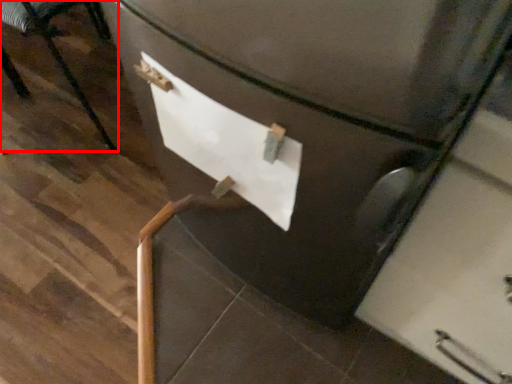
Question: From the image, what is the correct spatial relationship of furniture (annotated by the red box) in relation to paper?

Choices:
 (A) right
 (B) left

Answer: (B)